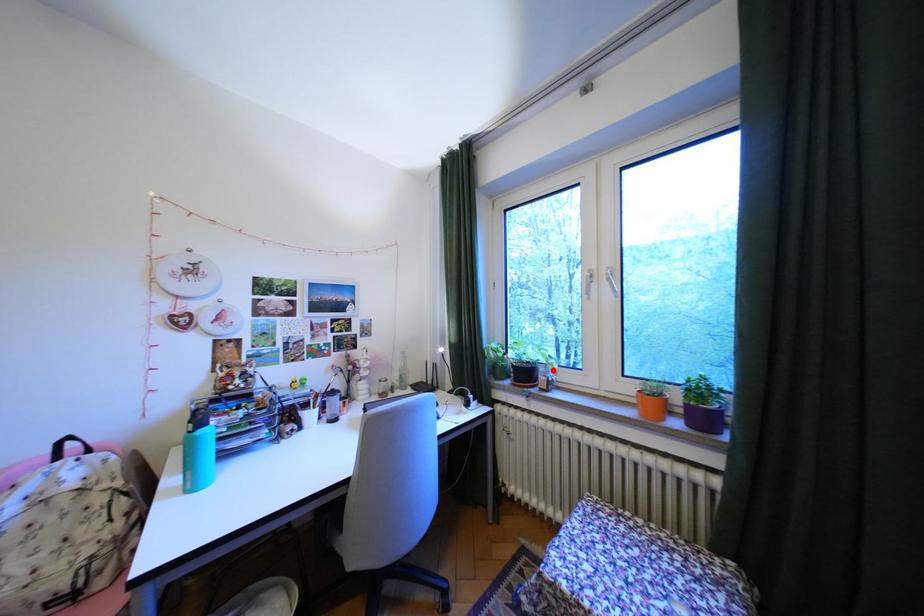
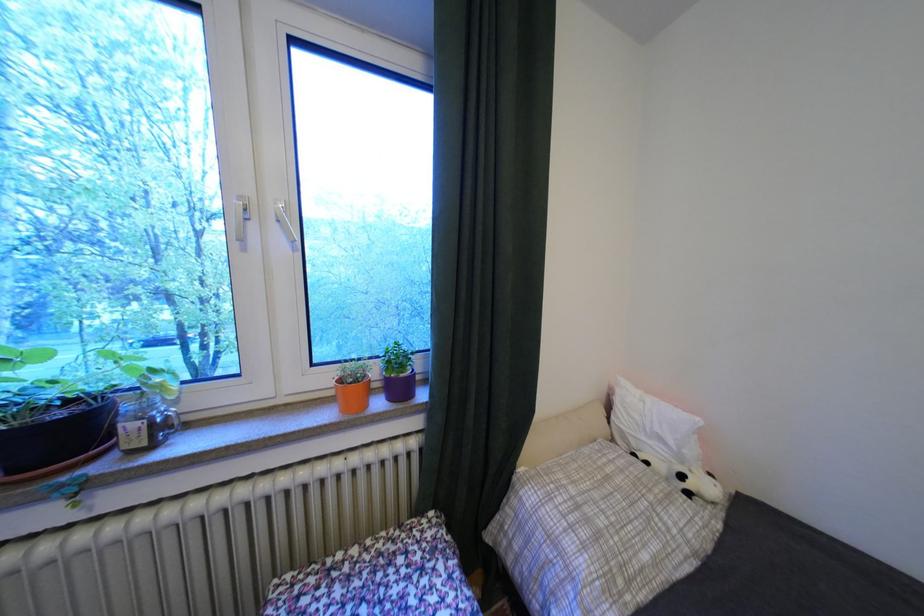
Where in the second image is the point corresponding to the highlighted location from the first image?

(138, 408)